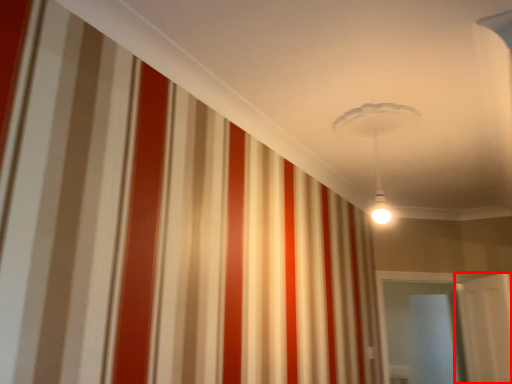
Question: In this image, where is door (annotated by the red box) located relative to glass door?

Choices:
 (A) left
 (B) right

Answer: (B)